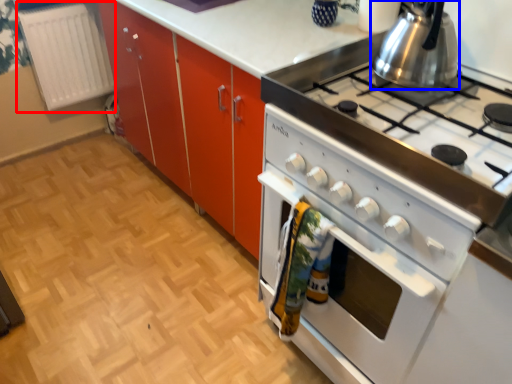
Question: Which object appears closest to the camera in this image, radiator (highlighted by a red box) or kitchen appliance (highlighted by a blue box)?

Choices:
 (A) radiator
 (B) kitchen appliance

Answer: (B)